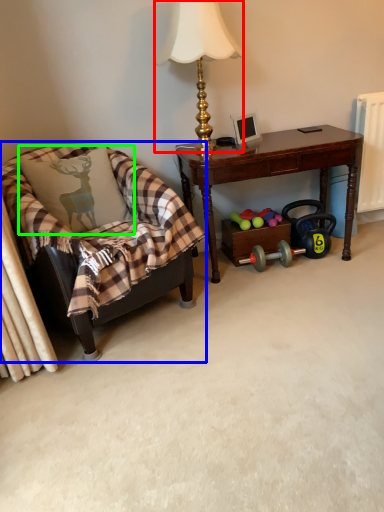
Question: Which object is the closest to the lamp (highlighted by a red box)? Choose among these: chair (highlighted by a blue box) or pillow (highlighted by a green box).

Choices:
 (A) chair
 (B) pillow

Answer: (B)